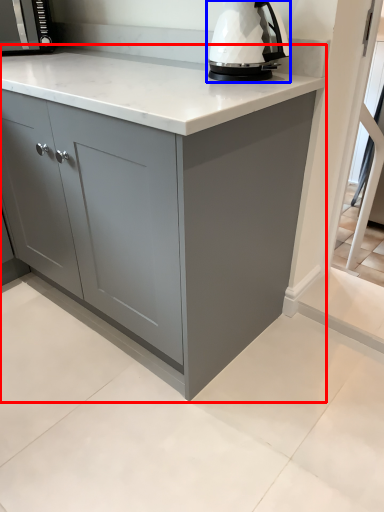
Question: Which point is further to the camera, cabinetry (highlighted by a red box) or home appliance (highlighted by a blue box)?

Choices:
 (A) cabinetry
 (B) home appliance

Answer: (B)